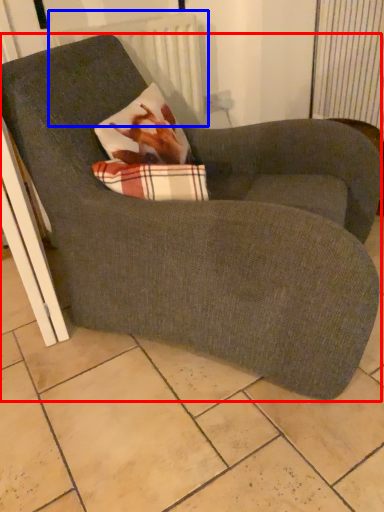
Question: Which object is closer to the camera taking this photo, chair (highlighted by a red box) or radiator (highlighted by a blue box)?

Choices:
 (A) chair
 (B) radiator

Answer: (A)